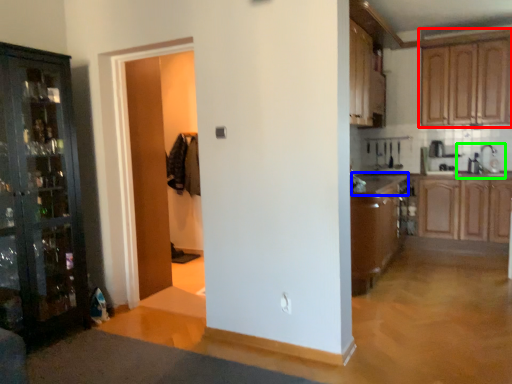
Question: Which object is positioned farthest from cabinetry (highlighted by a red box)? Select from counter top (highlighted by a blue box) and sink (highlighted by a green box).

Choices:
 (A) counter top
 (B) sink

Answer: (A)